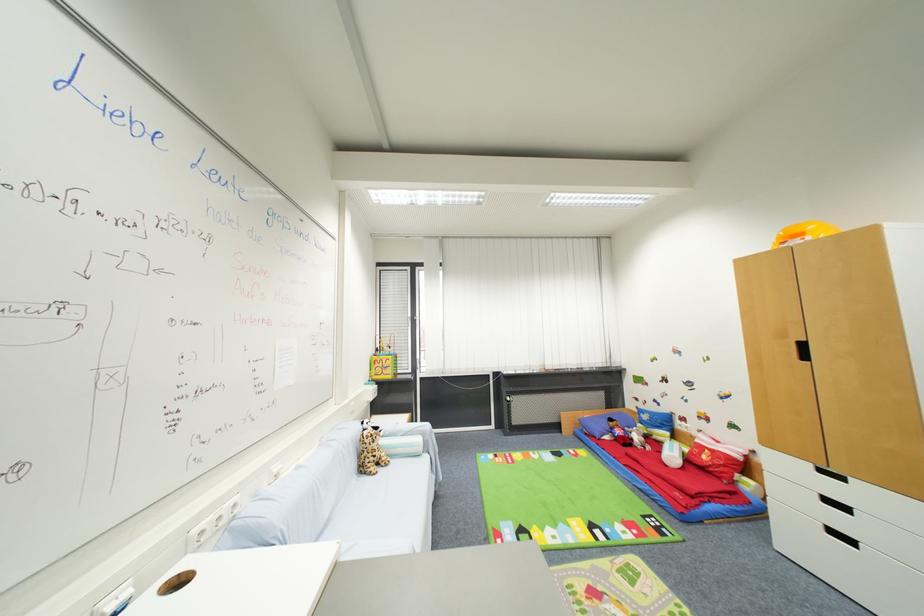
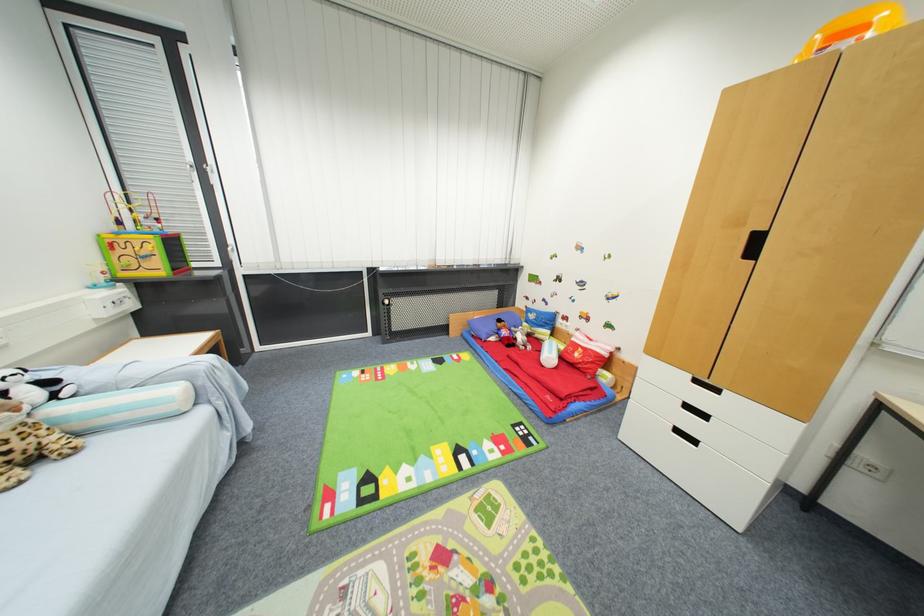
Where in the second image is the point corresponding to point 585,423 from the first image?

(475, 325)